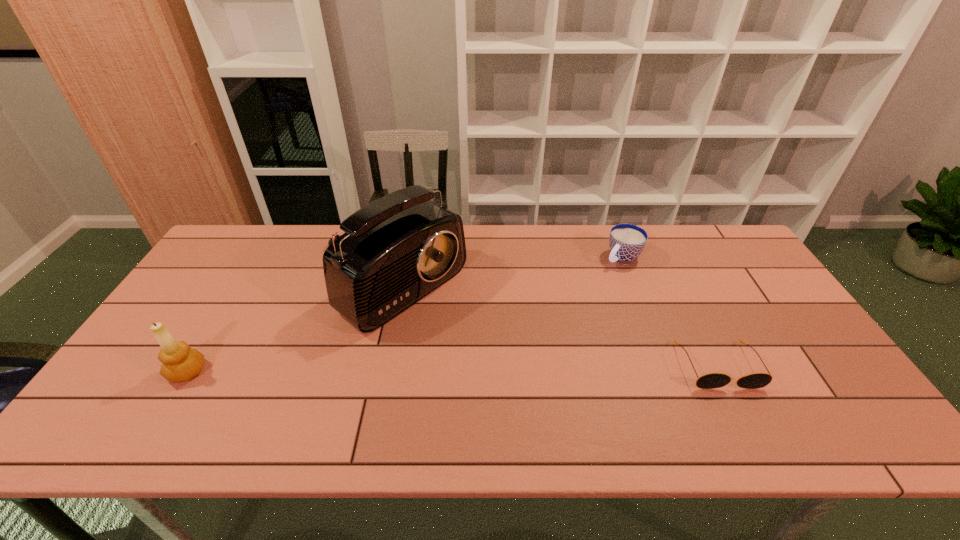
Find the location of `free space at the near edge of the desktop`. free space at the near edge of the desktop is located at coordinates (236, 394).

You are a GUI agent. You are given a task and a screenshot of the screen. Output one action in this format:
    pyautogui.click(x=<x>, y=<y>)
    Task: Click on the vacant space at the left edge of the desktop
    Image resolution: width=960 pixels, height=540 pixels.
    Given the screenshot: What is the action you would take?
    pyautogui.click(x=214, y=298)

Locate an element on the screen. This screenshot has height=540, width=960. vacant space at the right edge of the desktop is located at coordinates (732, 271).

You are a GUI agent. You are given a task and a screenshot of the screen. Output one action in this format:
    pyautogui.click(x=<x>, y=<y>)
    Task: Click on the vacant point at the far left corner
    The width and height of the screenshot is (960, 540).
    Given the screenshot: What is the action you would take?
    pyautogui.click(x=235, y=250)

In order to click on blank region between the cup and the sunglasses in this screenshot , I will do `click(670, 312)`.

I want to click on unoccupied area between the sunglasses and the radio receiver, so click(554, 324).

Find the location of `free spot between the cup and the leftmost object`. free spot between the cup and the leftmost object is located at coordinates (x=405, y=315).

At what (x,y) coordinates should I click in order to perform the action: click on vacant region between the third shortest object and the second object from left to right. Please return your answer as a coordinate pair (x, y). Looking at the image, I should click on pyautogui.click(x=289, y=327).

Image resolution: width=960 pixels, height=540 pixels. In order to click on vacant space that's between the sunglasses and the radio receiver in this screenshot , I will do [x=554, y=324].

Identify the location of free space between the shortest object and the leftmost object. (452, 369).